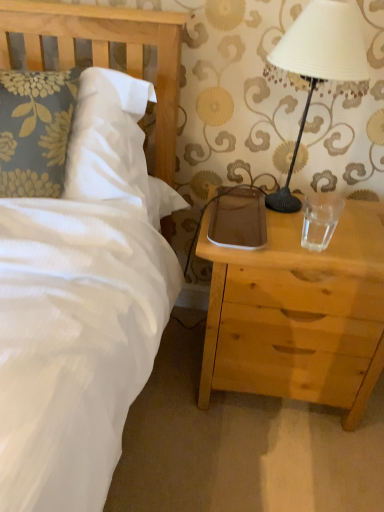
This screenshot has width=384, height=512. I want to click on unoccupied region to the right of white matte lampshade at upper right, so click(x=360, y=216).